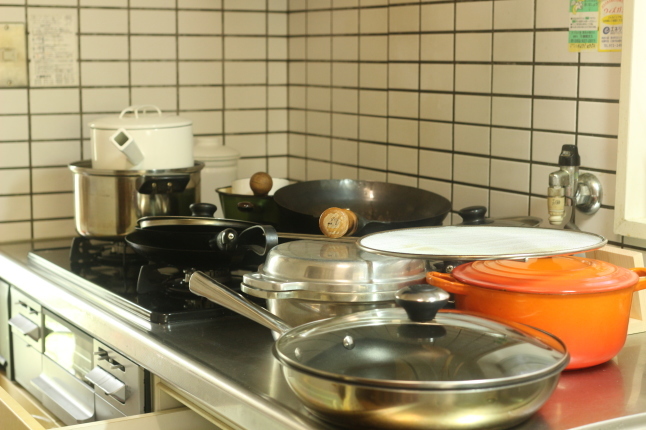
Find the location of `silver pots and pans`. silver pots and pans is located at coordinates (449, 397), (318, 264), (136, 196), (171, 223), (516, 218).